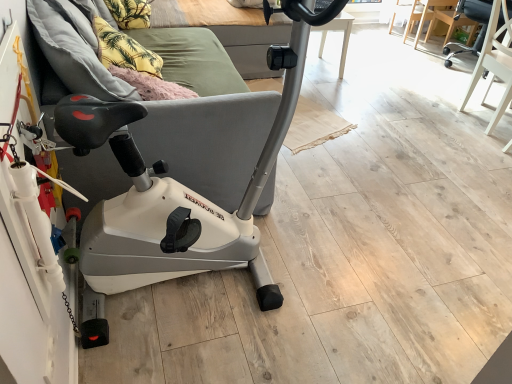
Locate an element on the screen. vacant space to the right of white plastic stationary bicycle at left is located at coordinates (357, 278).